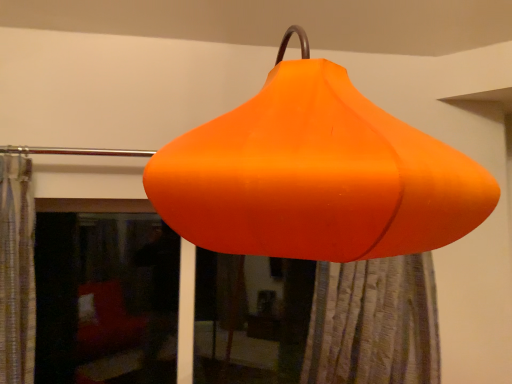
Question: Is transparent glass window at lower left at the left side of orange matte lampshade at center?

Choices:
 (A) no
 (B) yes

Answer: (B)

Question: From the image's perspective, is transparent glass window at lower left on top of orange matte lampshade at center?

Choices:
 (A) no
 (B) yes

Answer: (A)

Question: From a real-world perspective, is transparent glass window at lower left positioned over orange matte lampshade at center based on gravity?

Choices:
 (A) no
 (B) yes

Answer: (A)

Question: Is orange matte lampshade at center completely or partially inside transparent glass window at lower left?

Choices:
 (A) yes
 (B) no

Answer: (B)

Question: Is transparent glass window at lower left located outside orange matte lampshade at center?

Choices:
 (A) yes
 (B) no

Answer: (A)

Question: From a real-world perspective, relative to transparent glass window at lower left, is orange matte lampshade at center vertically above or below?

Choices:
 (A) above
 (B) below

Answer: (A)

Question: Considering the relative positions of orange matte lampshade at center and transparent glass window at lower left in the image provided, is orange matte lampshade at center to the left or to the right of transparent glass window at lower left?

Choices:
 (A) left
 (B) right

Answer: (B)

Question: Considering the positions of orange matte lampshade at center and transparent glass window at lower left in the image, is orange matte lampshade at center bigger or smaller than transparent glass window at lower left?

Choices:
 (A) big
 (B) small

Answer: (A)

Question: In terms of height, does orange matte lampshade at center look taller or shorter compared to transparent glass window at lower left?

Choices:
 (A) tall
 (B) short

Answer: (A)

Question: Do you think orange matte lampshade at center is within orange fabric shower curtain at lower center, or outside of it?

Choices:
 (A) outside
 (B) inside

Answer: (A)

Question: Is point (286, 218) closer or farther from the camera than point (393, 365)?

Choices:
 (A) farther
 (B) closer

Answer: (B)

Question: In the image, is orange matte lampshade at center on the left side or the right side of orange fabric shower curtain at lower center?

Choices:
 (A) left
 (B) right

Answer: (A)

Question: From a real-world perspective, is orange matte lampshade at center physically located above or below orange fabric shower curtain at lower center?

Choices:
 (A) above
 (B) below

Answer: (A)

Question: In terms of size, does transparent glass window at lower left appear bigger or smaller than orange fabric shower curtain at lower center?

Choices:
 (A) small
 (B) big

Answer: (A)

Question: Do you think transparent glass window at lower left is within orange fabric shower curtain at lower center, or outside of it?

Choices:
 (A) outside
 (B) inside

Answer: (A)